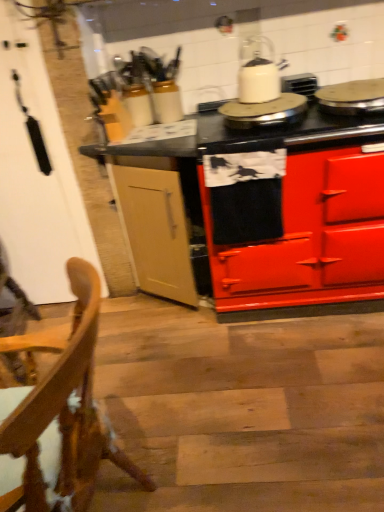
What is the approximate width of red glossy stove at center?

red glossy stove at center is 30.23 inches wide.

You are a GUI agent. You are given a task and a screenshot of the screen. Output one action in this format:
    pyautogui.click(x=<x>, y=<y>)
    Task: Click on the metallic silver pan at upper right, placed as the 2th appliance when sorted from left to right
    This screenshot has width=384, height=512.
    Given the screenshot: What is the action you would take?
    pyautogui.click(x=352, y=97)

Based on the photo, visually, is white glossy kettle at upper center positioned to the left or to the right of metallic silver pan at upper right, placed as the 2th appliance when sorted from left to right?

In the image, white glossy kettle at upper center appears on the left side of metallic silver pan at upper right, placed as the 2th appliance when sorted from left to right.

Is white glossy kettle at upper center completely or partially outside of metallic silver pan at upper right, placed as the 2th appliance when sorted from left to right?

Yes, white glossy kettle at upper center is outside of metallic silver pan at upper right, placed as the 2th appliance when sorted from left to right.

Considering the positions of points (242, 46) and (322, 88), is point (242, 46) closer to camera compared to point (322, 88)?

That is False.

From a real-world perspective, is white glossy kettle at upper center, the first appliance positioned from the left, over metallic silver pan at upper right, which ranks as the first appliance in right-to-left order?

No, from a real-world perspective, white glossy kettle at upper center, the first appliance positioned from the left, is not over metallic silver pan at upper right, which ranks as the first appliance in right-to-left order

In the image, is white glossy kettle at upper center, acting as the 2th appliance starting from the right, positioned in front of or behind metallic silver pan at upper right, which ranks as the first appliance in right-to-left order?

white glossy kettle at upper center, acting as the 2th appliance starting from the right, is behind metallic silver pan at upper right, which ranks as the first appliance in right-to-left order.

Is white glossy kettle at upper center, acting as the 2th appliance starting from the right, located outside metallic silver pan at upper right, which ranks as the first appliance in right-to-left order?

white glossy kettle at upper center, acting as the 2th appliance starting from the right, is positioned outside metallic silver pan at upper right, which ranks as the first appliance in right-to-left order.

Is white glossy kettle at upper center, acting as the 2th appliance starting from the right, positioned with its back to metallic silver pan at upper right, placed as the 2th appliance when sorted from left to right?

No, white glossy kettle at upper center, acting as the 2th appliance starting from the right, is not facing the opposite direction of metallic silver pan at upper right, placed as the 2th appliance when sorted from left to right.

Can you confirm if wooden chair at lower left is shorter than metallic silver pan at upper right, which ranks as the first appliance in right-to-left order?

In fact, wooden chair at lower left may be taller than metallic silver pan at upper right, which ranks as the first appliance in right-to-left order.

From a real-world perspective, is wooden chair at lower left physically below metallic silver pan at upper right, placed as the 2th appliance when sorted from left to right?

Indeed, from a real-world perspective, wooden chair at lower left is positioned beneath metallic silver pan at upper right, placed as the 2th appliance when sorted from left to right.

Does wooden chair at lower left come behind metallic silver pan at upper right, which ranks as the first appliance in right-to-left order?

No, wooden chair at lower left is in front of metallic silver pan at upper right, which ranks as the first appliance in right-to-left order.

Is wooden chair at lower left looking in the opposite direction of metallic silver pan at upper right, placed as the 2th appliance when sorted from left to right?

wooden chair at lower left is not turned away from metallic silver pan at upper right, placed as the 2th appliance when sorted from left to right.

Is white glossy kettle at upper center, acting as the 2th appliance starting from the right, looking in the opposite direction of white glossy kettle at upper center?

No, white glossy kettle at upper center, acting as the 2th appliance starting from the right,'s orientation is not away from white glossy kettle at upper center.

Is white glossy kettle at upper center, acting as the 2th appliance starting from the right, wider or thinner than white glossy kettle at upper center?

white glossy kettle at upper center, acting as the 2th appliance starting from the right, is wider than white glossy kettle at upper center.

Is white glossy kettle at upper center, acting as the 2th appliance starting from the right, taller or shorter than white glossy kettle at upper center?

white glossy kettle at upper center, acting as the 2th appliance starting from the right, is shorter than white glossy kettle at upper center.

Is white glossy kettle at upper center, acting as the 2th appliance starting from the right, thinner than red glossy stove at center?

Yes.

Does point (286, 106) come farther from viewer compared to point (367, 292)?

No, (286, 106) is closer to viewer.

Would you say white glossy kettle at upper center, the first appliance positioned from the left, is outside red glossy stove at center?

No, white glossy kettle at upper center, the first appliance positioned from the left, is not entirely external to red glossy stove at center.

Is white glossy kettle at upper center, the first appliance positioned from the left, aimed at wooden chair at lower left?

No, white glossy kettle at upper center, the first appliance positioned from the left, is not turned towards wooden chair at lower left.

From a real-world perspective, which is physically above, white glossy kettle at upper center, the first appliance positioned from the left, or wooden chair at lower left?

In real-world perspective, white glossy kettle at upper center, the first appliance positioned from the left, is above.

Visually, is white glossy kettle at upper center, the first appliance positioned from the left, positioned to the left or to the right of wooden chair at lower left?

white glossy kettle at upper center, the first appliance positioned from the left, is to the right of wooden chair at lower left.

Considering the points (273, 106) and (92, 476), which point is behind, point (273, 106) or point (92, 476)?

The point (273, 106) is behind.

Is the surface of wooden chair at lower left in direct contact with white glossy kettle at upper center, acting as the 2th appliance starting from the right?

wooden chair at lower left and white glossy kettle at upper center, acting as the 2th appliance starting from the right, are not in contact.

Is point (40, 393) behind point (289, 101)?

That is False.

Find the location of a particular element. The image size is (384, 512). the 1st appliance to the right of the wooden chair at lower left, counting from the anchor's position is located at coordinates (264, 112).

How different are the orientations of wooden chair at lower left and white glossy kettle at upper center, the first appliance positioned from the left, in degrees?

They differ by 85.2 degrees in their facing directions.

Find the location of a particular element. This screenshot has width=384, height=512. kitchen appliance above the metallic silver pan at upper right, placed as the 2th appliance when sorted from left to right (from the image's perspective) is located at coordinates (257, 73).

At what (x,y) coordinates should I click in order to perform the action: click on appliance to the right of white glossy kettle at upper center, acting as the 2th appliance starting from the right. Please return your answer as a coordinate pair (x, y). Looking at the image, I should click on (352, 97).

Considering their positions, is white glossy kettle at upper center positioned further to red glossy stove at center than metallic silver pan at upper right, which ranks as the first appliance in right-to-left order?

white glossy kettle at upper center is positioned further to the anchor red glossy stove at center.

Looking at the image, which one is located further to white glossy kettle at upper center, acting as the 2th appliance starting from the right, red glossy stove at center or white glossy kettle at upper center?

Based on the image, red glossy stove at center appears to be further to white glossy kettle at upper center, acting as the 2th appliance starting from the right.

Which object lies further to the anchor point metallic silver pan at upper right, placed as the 2th appliance when sorted from left to right, white glossy kettle at upper center or white glossy kettle at upper center, acting as the 2th appliance starting from the right?

white glossy kettle at upper center.

Looking at the image, which one is located closer to metallic silver pan at upper right, placed as the 2th appliance when sorted from left to right, white glossy kettle at upper center, acting as the 2th appliance starting from the right, or white glossy kettle at upper center?

white glossy kettle at upper center, acting as the 2th appliance starting from the right, lies closer to metallic silver pan at upper right, placed as the 2th appliance when sorted from left to right, than the other object.

Looking at the image, which one is located further to wooden chair at lower left, metallic silver pan at upper right, which ranks as the first appliance in right-to-left order, or white glossy kettle at upper center, the first appliance positioned from the left?

metallic silver pan at upper right, which ranks as the first appliance in right-to-left order, is positioned further to the anchor wooden chair at lower left.

Considering their positions, is white glossy kettle at upper center positioned further to wooden chair at lower left than red glossy stove at center?

white glossy kettle at upper center lies further to wooden chair at lower left than the other object.

From the image, which object appears to be farther from red glossy stove at center, white glossy kettle at upper center, the first appliance positioned from the left, or wooden chair at lower left?

wooden chair at lower left lies further to red glossy stove at center than the other object.

From the image, which object appears to be farther from white glossy kettle at upper center, the first appliance positioned from the left, metallic silver pan at upper right, which ranks as the first appliance in right-to-left order, or white glossy kettle at upper center?

Among the two, metallic silver pan at upper right, which ranks as the first appliance in right-to-left order, is located further to white glossy kettle at upper center, the first appliance positioned from the left.

Identify the location of cabinetry between white glossy kettle at upper center, acting as the 2th appliance starting from the right, and wooden chair at lower left in the up-down direction. Image resolution: width=384 pixels, height=512 pixels. (308, 236).

Image resolution: width=384 pixels, height=512 pixels. In order to click on appliance that lies between metallic silver pan at upper right, placed as the 2th appliance when sorted from left to right, and wooden chair at lower left from top to bottom in this screenshot , I will do `click(264, 112)`.

At what (x,y) coordinates should I click in order to perform the action: click on cabinetry between wooden chair at lower left and metallic silver pan at upper right, placed as the 2th appliance when sorted from left to right, from left to right. Please return your answer as a coordinate pair (x, y). Looking at the image, I should click on (308, 236).

This screenshot has width=384, height=512. Identify the location of cabinetry between white glossy kettle at upper center and wooden chair at lower left from top to bottom. (308, 236).